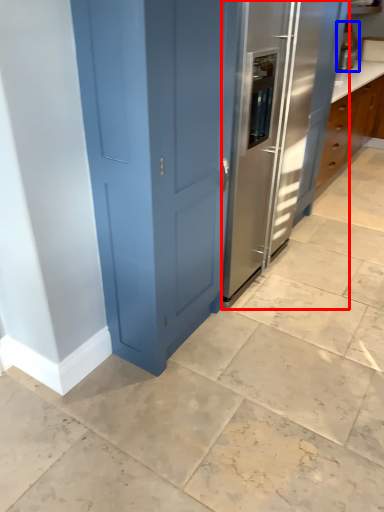
Question: Among these objects, which one is farthest to the camera, fridge (highlighted by a red box) or appliance (highlighted by a blue box)?

Choices:
 (A) fridge
 (B) appliance

Answer: (B)